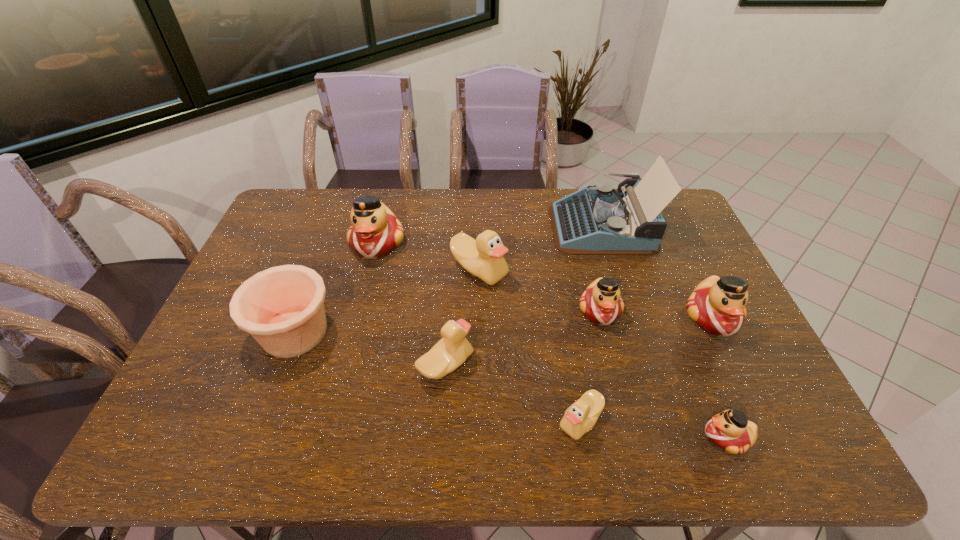
This screenshot has width=960, height=540. Identify the location of the smallest red duck. (730, 430).

Locate an element on the screen. The height and width of the screenshot is (540, 960). free region located on the typing side of the typewriter is located at coordinates (460, 226).

Locate an element on the screen. free space located 0.380m on the typing side of the typewriter is located at coordinates (443, 226).

The width and height of the screenshot is (960, 540). In order to click on free location located 0.370m on the typing side of the typewriter in this screenshot , I will do `click(445, 226)`.

Locate an element on the screen. blank space located 0.370m on the face of the tallest duck is located at coordinates (347, 365).

I want to click on vacant area situated 0.200m at the beak of the farthest beige duck, so click(x=479, y=346).

You are a GUI agent. You are given a task and a screenshot of the screen. Output one action in this format:
    pyautogui.click(x=<x>, y=<y>)
    Task: Click on the vacant space located 0.170m on the face of the second biggest red duck
    This screenshot has height=540, width=960.
    Given the screenshot: What is the action you would take?
    pyautogui.click(x=752, y=400)

At what (x,y) coordinates should I click in order to perform the action: click on vacant space located on the right of the pottery. Please return your answer as a coordinate pair (x, y). The height and width of the screenshot is (540, 960). Looking at the image, I should click on (471, 333).

Image resolution: width=960 pixels, height=540 pixels. What are the coordinates of `free space located at the beak of the second nearest beige duck` in the screenshot? It's located at [x=613, y=365].

The image size is (960, 540). I want to click on vacant space positioned 0.320m on the face of the second smallest red duck, so click(634, 444).